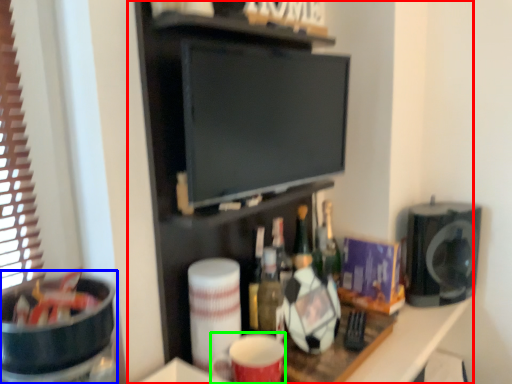
Question: Estimate the real-world distances between objects in this image. Which object is farther from entertainment center (highlighted by a red box), appliance (highlighted by a blue box) or mug (highlighted by a green box)?

Choices:
 (A) appliance
 (B) mug

Answer: (A)